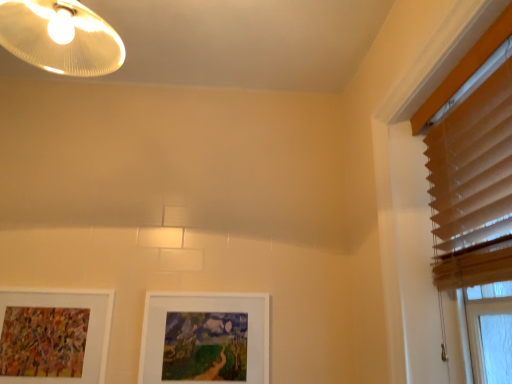
The height and width of the screenshot is (384, 512). What do you see at coordinates (205, 338) in the screenshot?
I see `white matte picture frame at center, the 2th picture frame in the left-to-right sequence` at bounding box center [205, 338].

What do you see at coordinates (60, 37) in the screenshot? The width and height of the screenshot is (512, 384). I see `matte white lampshade at upper left` at bounding box center [60, 37].

The height and width of the screenshot is (384, 512). Find the location of `beige wood blinds at upper right`. beige wood blinds at upper right is located at coordinates (473, 187).

Identify the location of white matte picture frame at center, acting as the first picture frame starting from the right. (205, 338).

Are white matte picture frame at lower left, arranged as the first picture frame when viewed from the left, and beige wood blinds at upper right located far from each other?

Yes, white matte picture frame at lower left, arranged as the first picture frame when viewed from the left, and beige wood blinds at upper right are quite far apart.

From the image's perspective, is white matte picture frame at lower left, marked as the second picture frame in a right-to-left arrangement, located above or below beige wood blinds at upper right?

Based on their image positions, white matte picture frame at lower left, marked as the second picture frame in a right-to-left arrangement, is located beneath beige wood blinds at upper right.

Can you confirm if white matte picture frame at lower left, arranged as the first picture frame when viewed from the left, is shorter than beige wood blinds at upper right?

Yes, white matte picture frame at lower left, arranged as the first picture frame when viewed from the left, is shorter than beige wood blinds at upper right.

Does beige wood blinds at upper right have a lesser height compared to white matte picture frame at lower left, arranged as the first picture frame when viewed from the left?

No.

Is beige wood blinds at upper right wider than white matte picture frame at lower left, arranged as the first picture frame when viewed from the left?

Indeed, beige wood blinds at upper right has a greater width compared to white matte picture frame at lower left, arranged as the first picture frame when viewed from the left.

In the image, is beige wood blinds at upper right on the left side or the right side of white matte picture frame at lower left, marked as the second picture frame in a right-to-left arrangement?

beige wood blinds at upper right is positioned on white matte picture frame at lower left, marked as the second picture frame in a right-to-left arrangement,'s right side.

Where is `lamp that is above the white matte picture frame at center, acting as the first picture frame starting from the right (from a real-world perspective)`? Image resolution: width=512 pixels, height=384 pixels. lamp that is above the white matte picture frame at center, acting as the first picture frame starting from the right (from a real-world perspective) is located at coordinates (60, 37).

From the image's perspective, between matte white lampshade at upper left and white matte picture frame at center, the 2th picture frame in the left-to-right sequence, which one is located above?

matte white lampshade at upper left, from the image's perspective.

Is matte white lampshade at upper left with white matte picture frame at center, the 2th picture frame in the left-to-right sequence?

No, matte white lampshade at upper left is not in contact with white matte picture frame at center, the 2th picture frame in the left-to-right sequence.

Is matte white lampshade at upper left thinner than white matte picture frame at center, acting as the first picture frame starting from the right?

In fact, matte white lampshade at upper left might be wider than white matte picture frame at center, acting as the first picture frame starting from the right.

How different are the orientations of beige wood blinds at upper right and white matte picture frame at center, acting as the first picture frame starting from the right, in degrees?

The angle between the facing direction of beige wood blinds at upper right and the facing direction of white matte picture frame at center, acting as the first picture frame starting from the right, is 90.7 degrees.

From the image's perspective, would you say beige wood blinds at upper right is shown under white matte picture frame at center, the 2th picture frame in the left-to-right sequence?

No, from the image's perspective, beige wood blinds at upper right is not beneath white matte picture frame at center, the 2th picture frame in the left-to-right sequence.

Consider the image. Which of these two, beige wood blinds at upper right or white matte picture frame at center, acting as the first picture frame starting from the right, is wider?

beige wood blinds at upper right.

Based on the photo, does white matte picture frame at center, acting as the first picture frame starting from the right, have a larger size compared to beige wood blinds at upper right?

No, white matte picture frame at center, acting as the first picture frame starting from the right, is not bigger than beige wood blinds at upper right.

Which object is further away from the camera taking this photo, white matte picture frame at center, the 2th picture frame in the left-to-right sequence, or beige wood blinds at upper right?

white matte picture frame at center, the 2th picture frame in the left-to-right sequence, is behind.

Considering the relative sizes of white matte picture frame at center, acting as the first picture frame starting from the right, and beige wood blinds at upper right in the image provided, is white matte picture frame at center, acting as the first picture frame starting from the right, thinner than beige wood blinds at upper right?

Yes, white matte picture frame at center, acting as the first picture frame starting from the right, is thinner than beige wood blinds at upper right.

Which of these two, white matte picture frame at center, the 2th picture frame in the left-to-right sequence, or white matte picture frame at lower left, arranged as the first picture frame when viewed from the left, is bigger?

With larger size is white matte picture frame at center, the 2th picture frame in the left-to-right sequence.

Which object is closer to the camera taking this photo, white matte picture frame at center, the 2th picture frame in the left-to-right sequence, or white matte picture frame at lower left, marked as the second picture frame in a right-to-left arrangement?

white matte picture frame at lower left, marked as the second picture frame in a right-to-left arrangement.

Can you tell me how much white matte picture frame at center, acting as the first picture frame starting from the right, and white matte picture frame at lower left, arranged as the first picture frame when viewed from the left, differ in facing direction?

1.87 degrees separate the facing orientations of white matte picture frame at center, acting as the first picture frame starting from the right, and white matte picture frame at lower left, arranged as the first picture frame when viewed from the left.

Between white matte picture frame at center, the 2th picture frame in the left-to-right sequence, and white matte picture frame at lower left, arranged as the first picture frame when viewed from the left, which one appears on the right side from the viewer's perspective?

white matte picture frame at center, the 2th picture frame in the left-to-right sequence.

Is point (39, 67) positioned in front of point (490, 207)?

No, it is behind (490, 207).

Which object is further away from the camera taking this photo, matte white lampshade at upper left or beige wood blinds at upper right?

matte white lampshade at upper left is further away from the camera.

Is matte white lampshade at upper left to the right of beige wood blinds at upper right from the viewer's perspective?

No.

Where is `lamp above the beige wood blinds at upper right (from the image's perspective)`? The image size is (512, 384). lamp above the beige wood blinds at upper right (from the image's perspective) is located at coordinates (60, 37).

Identify the location of blind located in front of the white matte picture frame at lower left, arranged as the first picture frame when viewed from the left. The width and height of the screenshot is (512, 384). (473, 187).

Which picture frame is the 2nd one when counting from the left side of the beige wood blinds at upper right? Please provide its 2D coordinates.

[(54, 336)]

Which object lies nearer to the anchor point white matte picture frame at center, acting as the first picture frame starting from the right, white matte picture frame at lower left, marked as the second picture frame in a right-to-left arrangement, or matte white lampshade at upper left?

white matte picture frame at lower left, marked as the second picture frame in a right-to-left arrangement, is closer to white matte picture frame at center, acting as the first picture frame starting from the right.

Estimate the real-world distances between objects in this image. Which object is closer to white matte picture frame at lower left, arranged as the first picture frame when viewed from the left, white matte picture frame at center, acting as the first picture frame starting from the right, or beige wood blinds at upper right?

white matte picture frame at center, acting as the first picture frame starting from the right, is positioned closer to the anchor white matte picture frame at lower left, arranged as the first picture frame when viewed from the left.

From the image, which object appears to be farther from beige wood blinds at upper right, white matte picture frame at center, acting as the first picture frame starting from the right, or white matte picture frame at lower left, arranged as the first picture frame when viewed from the left?

white matte picture frame at lower left, arranged as the first picture frame when viewed from the left, is further to beige wood blinds at upper right.

Estimate the real-world distances between objects in this image. Which object is further from white matte picture frame at lower left, arranged as the first picture frame when viewed from the left, beige wood blinds at upper right or white matte picture frame at center, acting as the first picture frame starting from the right?

The object further to white matte picture frame at lower left, arranged as the first picture frame when viewed from the left, is beige wood blinds at upper right.

From the image, which object appears to be farther from white matte picture frame at center, acting as the first picture frame starting from the right, matte white lampshade at upper left or white matte picture frame at lower left, marked as the second picture frame in a right-to-left arrangement?

The object further to white matte picture frame at center, acting as the first picture frame starting from the right, is matte white lampshade at upper left.

Looking at the image, which one is located further to matte white lampshade at upper left, beige wood blinds at upper right or white matte picture frame at center, acting as the first picture frame starting from the right?

white matte picture frame at center, acting as the first picture frame starting from the right.

Based on their spatial positions, is white matte picture frame at center, acting as the first picture frame starting from the right, or matte white lampshade at upper left further from beige wood blinds at upper right?

matte white lampshade at upper left.

Which object lies further to the anchor point matte white lampshade at upper left, white matte picture frame at center, acting as the first picture frame starting from the right, or white matte picture frame at lower left, marked as the second picture frame in a right-to-left arrangement?

Based on the image, white matte picture frame at center, acting as the first picture frame starting from the right, appears to be further to matte white lampshade at upper left.

Where is `blind between matte white lampshade at upper left and white matte picture frame at center, the 2th picture frame in the left-to-right sequence, from top to bottom`? The image size is (512, 384). blind between matte white lampshade at upper left and white matte picture frame at center, the 2th picture frame in the left-to-right sequence, from top to bottom is located at coordinates (473, 187).

The width and height of the screenshot is (512, 384). What are the coordinates of `picture frame between white matte picture frame at lower left, arranged as the first picture frame when viewed from the left, and beige wood blinds at upper right` in the screenshot? It's located at (205, 338).

This screenshot has width=512, height=384. I want to click on lamp between white matte picture frame at lower left, marked as the second picture frame in a right-to-left arrangement, and beige wood blinds at upper right from left to right, so click(x=60, y=37).

This screenshot has height=384, width=512. I want to click on picture frame between matte white lampshade at upper left and white matte picture frame at center, the 2th picture frame in the left-to-right sequence, from top to bottom, so click(54, 336).